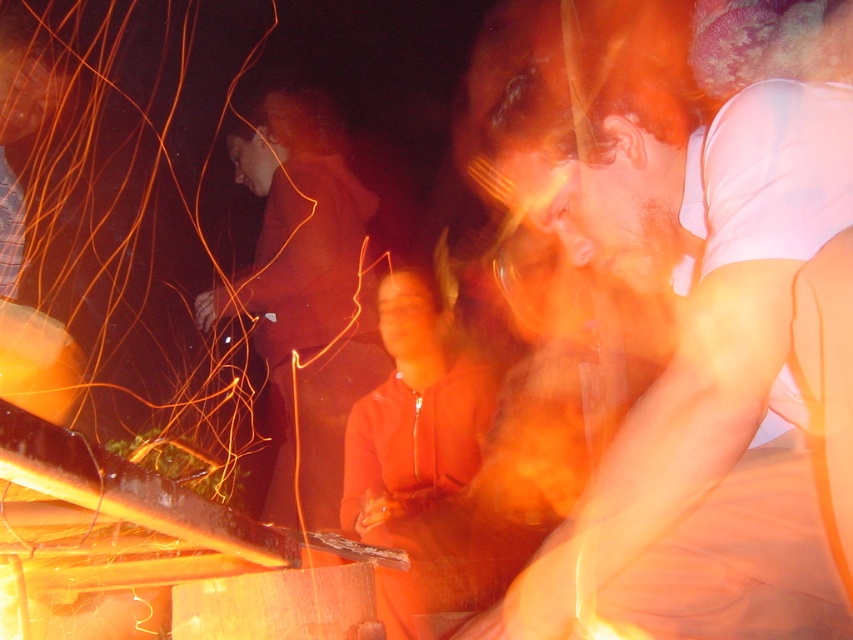
You are a photographer trying to capture a clear photo of both the smooth white shirt at center and the matte orange hoodie at center. The camera has a depth of field that can focus on objects within 1.5 meters of each other. Will both objects be in focus?

The smooth white shirt at center is 1.78 meters away from matte orange hoodie at center. Since the distance between them exceeds the camera depth of field of 1.5 meters, the camera cannot focus on both objects simultaneously.

You are organizing a charity event and need to place a matte orange hoodie at center and a matte orange jacket at center on a display rack. The rack has a width of 1.2 meters. Given their widths, can both items fit side by side on the rack without overlapping?

The matte orange hoodie at center is wider than the matte orange jacket at center. However, since the exact widths are not provided, it is impossible to determine if both can fit on the 1.2 meter rack without overlapping.